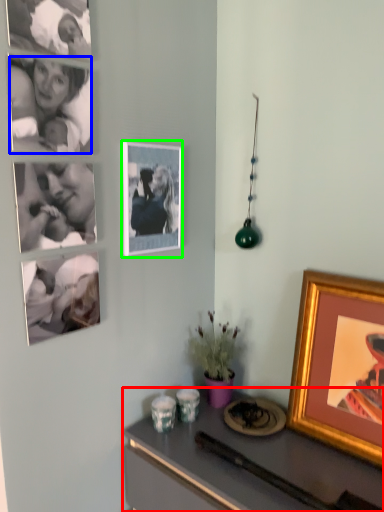
Question: Which object is positioned farthest from desk (highlighted by a red box)? Select from person (highlighted by a blue box) and picture frame (highlighted by a green box).

Choices:
 (A) person
 (B) picture frame

Answer: (A)